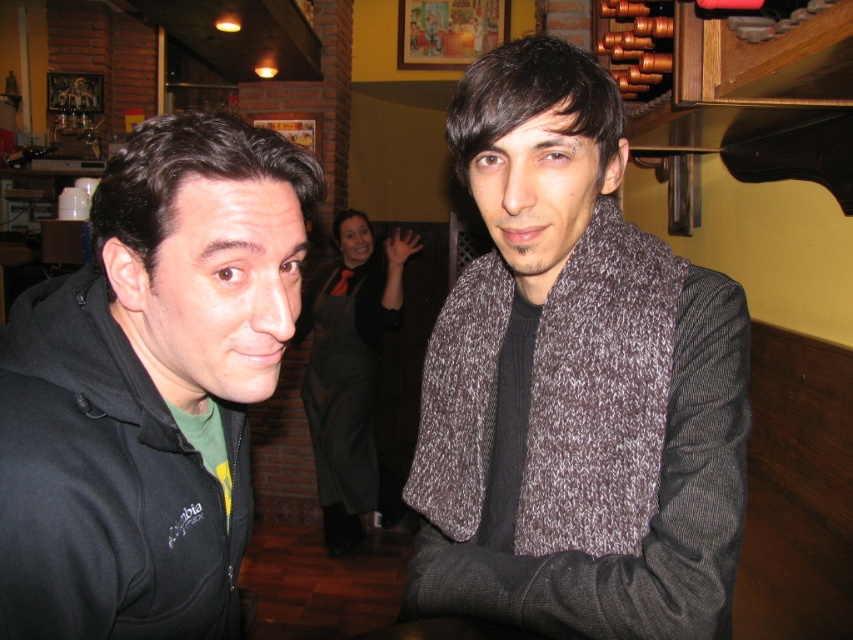
Is knitted gray scarf at center bigger than black matte hoodie at left?

Yes, knitted gray scarf at center is bigger than black matte hoodie at left.

Which is above, knitted gray scarf at center or black matte hoodie at left?

knitted gray scarf at center is above.

Where is `knitted gray scarf at center`? This screenshot has height=640, width=853. knitted gray scarf at center is located at coordinates (573, 384).

This screenshot has height=640, width=853. Describe the element at coordinates (149, 387) in the screenshot. I see `black matte hoodie at left` at that location.

Is black matte hoodie at left above black sheer dress at center?

Correct, black matte hoodie at left is located above black sheer dress at center.

Find the location of a particular element. The height and width of the screenshot is (640, 853). black matte hoodie at left is located at coordinates (149, 387).

Can you confirm if knitted gray scarf at center is taller than black sheer dress at center?

No.

Looking at this image, can you confirm if knitted gray scarf at center is positioned above black sheer dress at center?

Indeed, knitted gray scarf at center is positioned over black sheer dress at center.

Is point (593, 275) in front of point (317, 340)?

Yes.

This screenshot has height=640, width=853. In order to click on knitted gray scarf at center in this screenshot , I will do `click(573, 384)`.